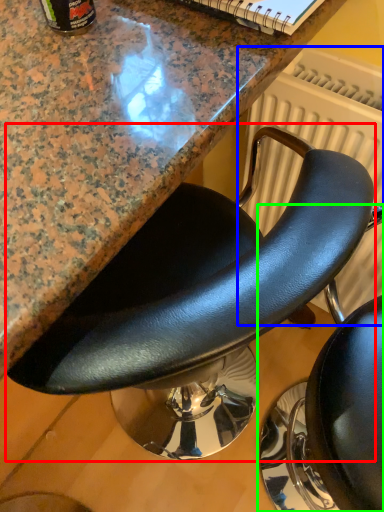
Question: Which is farther away from chair (highlighted by a red box)? radiator (highlighted by a blue box) or chair (highlighted by a green box)?

Choices:
 (A) radiator
 (B) chair

Answer: (B)